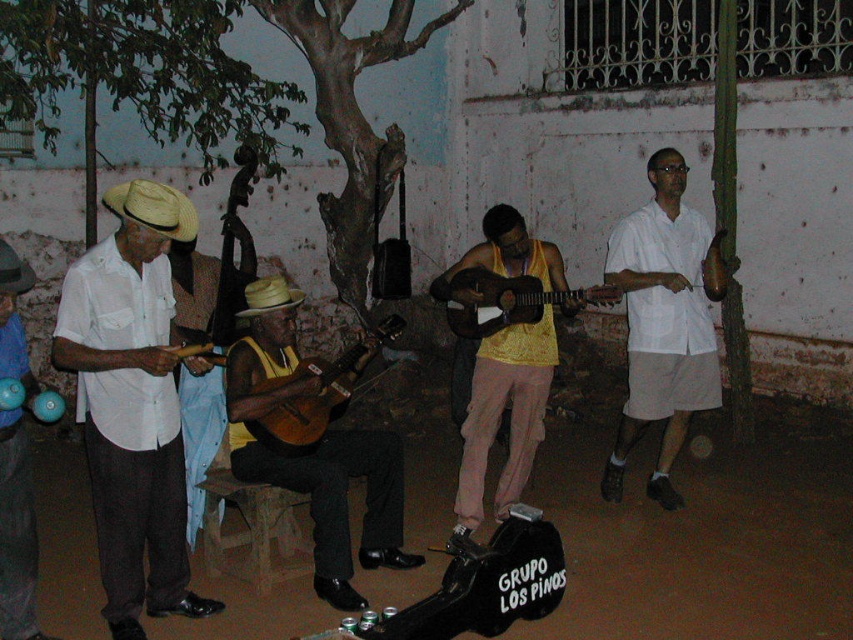
Which is above, matte straw hat at left or acoustic wood guitar at center?

matte straw hat at left is above.

Is matte straw hat at left closer to the viewer compared to acoustic wood guitar at center?

No, matte straw hat at left is behind acoustic wood guitar at center.

Between point (213, 296) and point (323, 378), which one is positioned in front?

Point (323, 378) is in front.

Where is `matte straw hat at left`? matte straw hat at left is located at coordinates (199, 435).

Which is in front, point (399, 492) or point (509, 353)?

Positioned in front is point (399, 492).

Does matte yellow tank top at center have a greater width compared to yellow matte tank top at center?

Indeed, matte yellow tank top at center has a greater width compared to yellow matte tank top at center.

In the scene shown: Who is more distant from viewer, (271,476) or (461,490)?

The point (461,490) is behind.

Find the location of a particular element. The width and height of the screenshot is (853, 640). matte yellow tank top at center is located at coordinates (312, 451).

I want to click on matte yellow tank top at center, so click(312, 451).

This screenshot has height=640, width=853. In order to click on matte yellow tank top at center in this screenshot , I will do `click(312, 451)`.